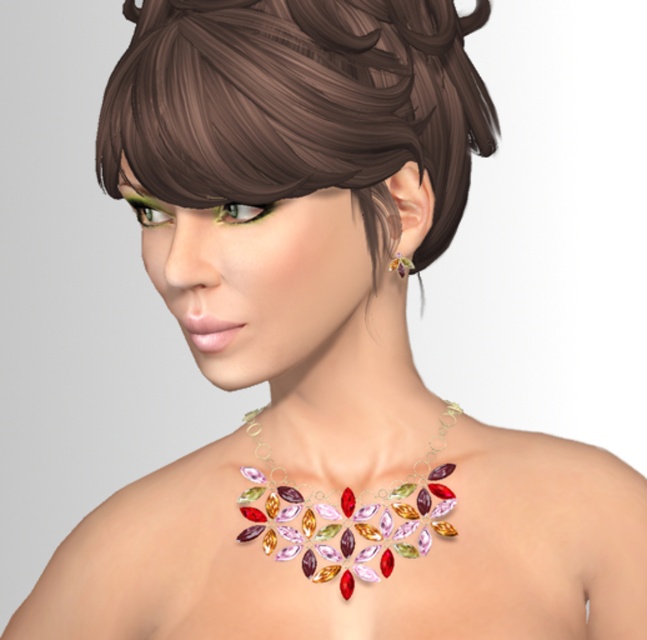
Question: Is multicolored gemstone necklace at center smaller than shiny gold earring at ear?

Choices:
 (A) no
 (B) yes

Answer: (A)

Question: Does multicolored gemstone necklace at center appear on the right side of shiny gold earring at ear?

Choices:
 (A) yes
 (B) no

Answer: (B)

Question: Can you confirm if multicolored gemstone necklace at center is positioned above shiny gold earring at ear?

Choices:
 (A) no
 (B) yes

Answer: (A)

Question: Which object appears closest to the camera in this image?

Choices:
 (A) multicolored gemstone necklace at center
 (B) shiny gold earring at ear

Answer: (A)

Question: Which point is closer to the camera taking this photo?

Choices:
 (A) (437, 480)
 (B) (391, 260)

Answer: (B)